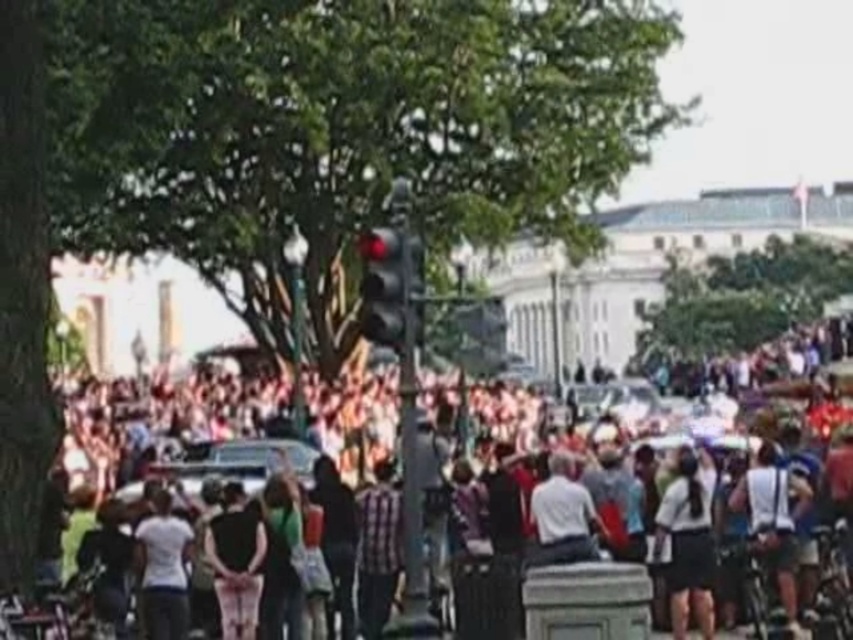
Is point (674, 518) positioned after point (395, 308)?

Yes, it is.

Is white cotton shirt at center further to the viewer compared to black glass traffic light at center?

That is True.

Image resolution: width=853 pixels, height=640 pixels. In order to click on white cotton shirt at center in this screenshot , I will do `click(688, 547)`.

Does matte black crowd at center have a lesser height compared to black glass traffic light at center?

Incorrect, matte black crowd at center's height does not fall short of black glass traffic light at center's.

Who is more forward, (x=213, y=412) or (x=381, y=282)?

Point (x=381, y=282) is in front.

The width and height of the screenshot is (853, 640). What are the coordinates of `matte black crowd at center` in the screenshot? It's located at (178, 435).

From the picture: Does matte black crowd at center appear under white cotton shirt at center?

No, matte black crowd at center is not below white cotton shirt at center.

Is matte black crowd at center above white cotton shirt at center?

Correct, matte black crowd at center is located above white cotton shirt at center.

Find the location of a particular element. This screenshot has height=640, width=853. matte black crowd at center is located at coordinates (178, 435).